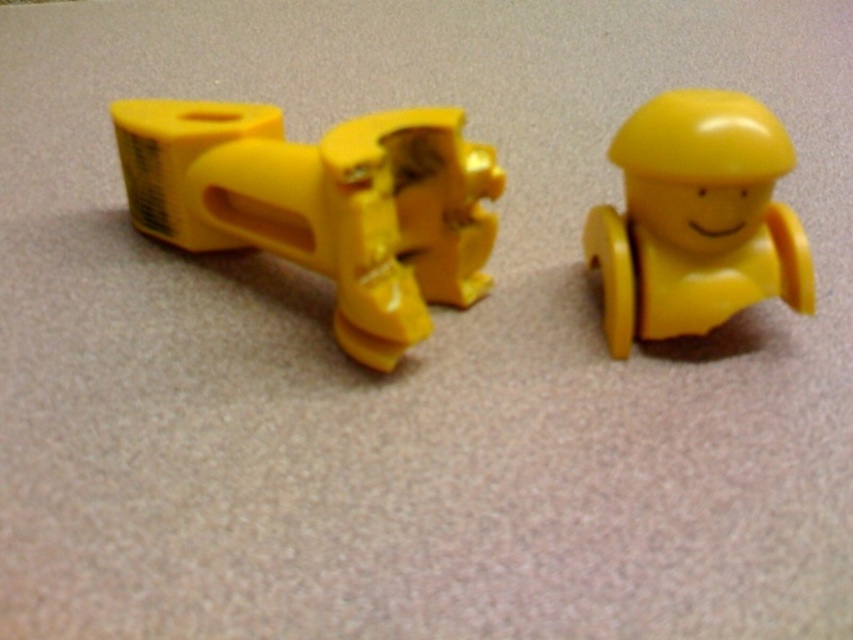
Is matte yellow toy at left below yellow matte toy at right?

Actually, matte yellow toy at left is above yellow matte toy at right.

Is matte yellow toy at left above yellow matte toy at right?

Yes, matte yellow toy at left is above yellow matte toy at right.

The width and height of the screenshot is (853, 640). In order to click on matte yellow toy at left in this screenshot , I will do `click(323, 204)`.